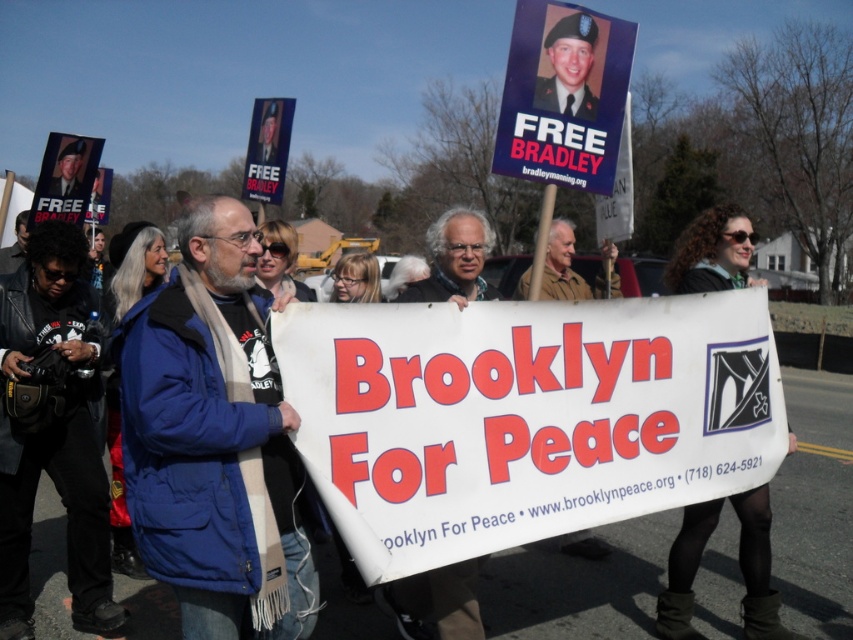
You are a photographer at the protest and need to capture both the blue fabric jacket at center and the black leather jacket at lower left in a single frame. Which jacket should you focus on to ensure both are visible without zooming in or out?

The blue fabric jacket at center is smaller than the black leather jacket at lower left, so focusing on the black leather jacket at lower left will allow both to be visible in the frame without needing to adjust the zoom.